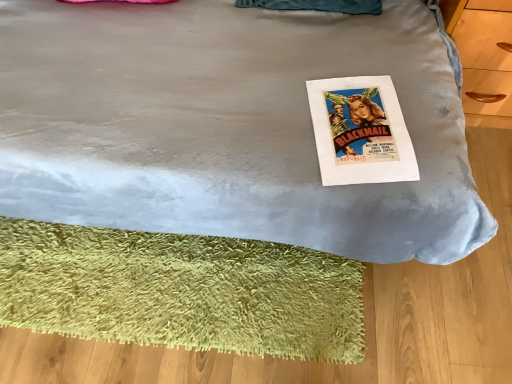
Question: From a real-world perspective, is velvet blue bed at center physically located above or below green shaggy mat at lower left?

Choices:
 (A) below
 (B) above

Answer: (B)

Question: From the image's perspective, is velvet blue bed at center above or below green shaggy mat at lower left?

Choices:
 (A) above
 (B) below

Answer: (A)

Question: Considering the real-world distances, which object is farthest from the green shaggy mat at lower left?

Choices:
 (A) white paper at center
 (B) velvet blue bed at center

Answer: (A)

Question: Which of these objects is positioned closest to the white paper at center?

Choices:
 (A) green shaggy mat at lower left
 (B) velvet blue bed at center

Answer: (B)